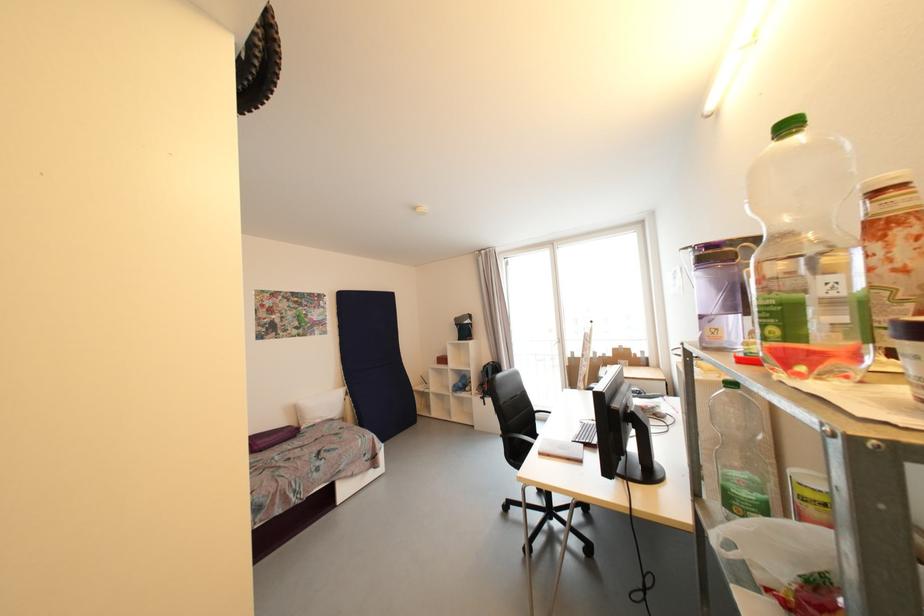
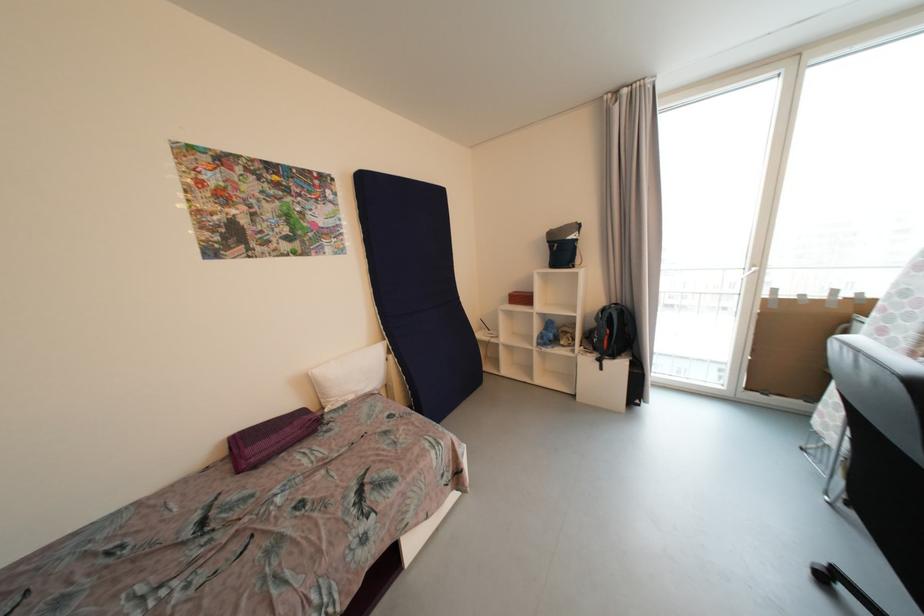
Find the pixel in the second image that matches point (447, 362) in the first image.

(528, 300)